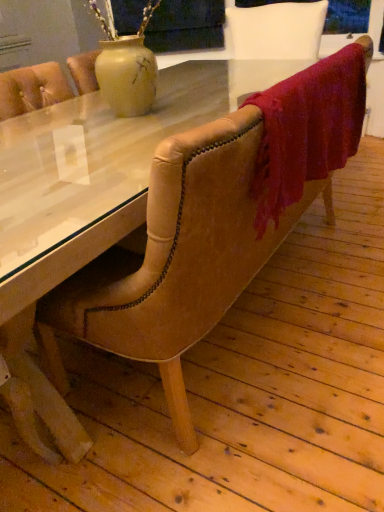
Question: Should I look upward or downward to see transparent glass table at center?

Choices:
 (A) up
 (B) down

Answer: (A)

Question: From the image's perspective, is transparent glass table at center located beneath velvet red blanket at upper right?

Choices:
 (A) no
 (B) yes

Answer: (B)

Question: Is transparent glass table at center smaller than velvet red blanket at upper right?

Choices:
 (A) no
 (B) yes

Answer: (A)

Question: Does transparent glass table at center have a lesser width compared to velvet red blanket at upper right?

Choices:
 (A) no
 (B) yes

Answer: (A)

Question: Is transparent glass table at center positioned with its back to velvet red blanket at upper right?

Choices:
 (A) yes
 (B) no

Answer: (B)

Question: From the image's perspective, would you say transparent glass table at center is positioned over velvet red blanket at upper right?

Choices:
 (A) yes
 (B) no

Answer: (B)

Question: Could velvet red blanket at upper right be considered to be inside transparent glass table at center?

Choices:
 (A) yes
 (B) no

Answer: (B)

Question: Does velvet red blanket at upper right have a larger size compared to transparent glass table at center?

Choices:
 (A) no
 (B) yes

Answer: (A)

Question: Does velvet red blanket at upper right appear on the left side of transparent glass table at center?

Choices:
 (A) no
 (B) yes

Answer: (A)

Question: Is velvet red blanket at upper right wider than transparent glass table at center?

Choices:
 (A) no
 (B) yes

Answer: (A)

Question: Would you say velvet red blanket at upper right is outside transparent glass table at center?

Choices:
 (A) yes
 (B) no

Answer: (A)

Question: Is velvet red blanket at upper right in contact with transparent glass table at center?

Choices:
 (A) no
 (B) yes

Answer: (A)

Question: Is velvet red blanket at upper right thinner than transparent glass table at center?

Choices:
 (A) yes
 (B) no

Answer: (A)

Question: In terms of width, does transparent glass table at center look wider or thinner when compared to velvet red blanket at upper right?

Choices:
 (A) thin
 (B) wide

Answer: (B)